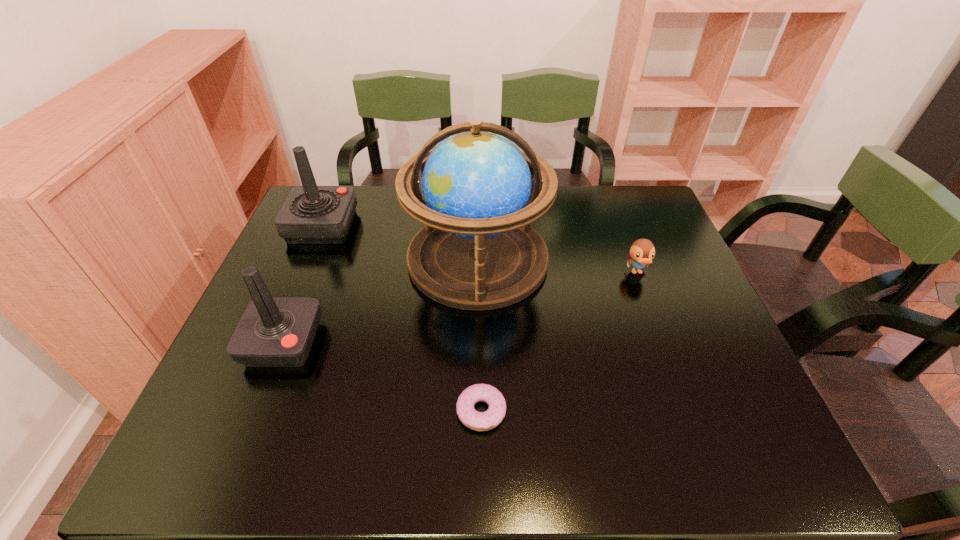
Find the location of `vacant space located on the front-facing side of the duck`. vacant space located on the front-facing side of the duck is located at coordinates (684, 396).

Where is `blank space located 0.380m on the back of the shortest object`? The height and width of the screenshot is (540, 960). blank space located 0.380m on the back of the shortest object is located at coordinates (481, 267).

Locate an element on the screen. globe located at the far edge is located at coordinates (477, 251).

At what (x,y) coordinates should I click in order to perform the action: click on joystick that is at the far edge. Please return your answer as a coordinate pair (x, y). Looking at the image, I should click on (311, 214).

Where is `object that is at the near edge`? object that is at the near edge is located at coordinates (479, 421).

The height and width of the screenshot is (540, 960). I want to click on object located in the right edge section of the desktop, so (642, 251).

The image size is (960, 540). What are the coordinates of `object that is at the far left corner` in the screenshot? It's located at (311, 214).

Where is `free space at the far edge of the desktop`? The height and width of the screenshot is (540, 960). free space at the far edge of the desktop is located at coordinates (582, 194).

Locate an element on the screen. free region at the near edge is located at coordinates (469, 461).

Where is `free space at the left edge of the desktop`? The height and width of the screenshot is (540, 960). free space at the left edge of the desktop is located at coordinates point(221,388).